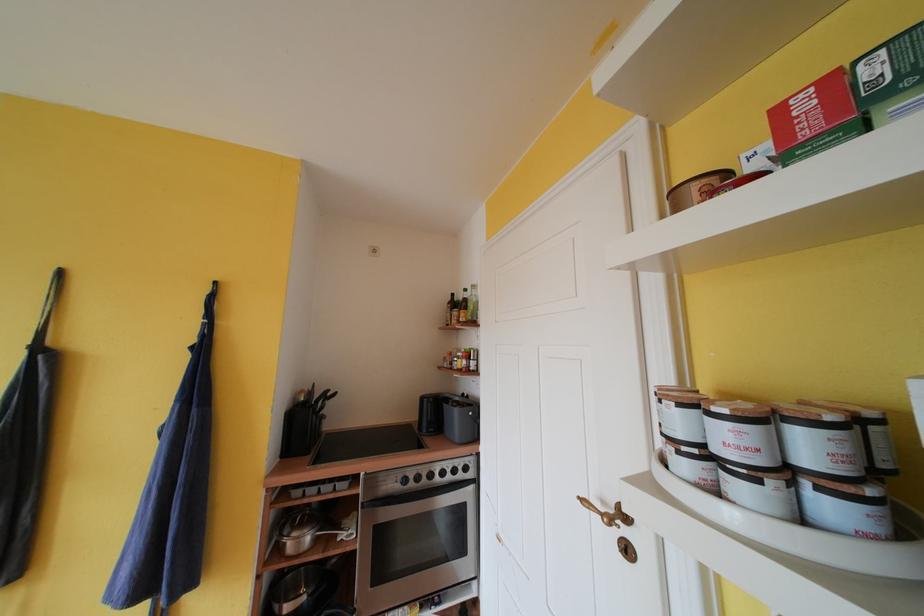
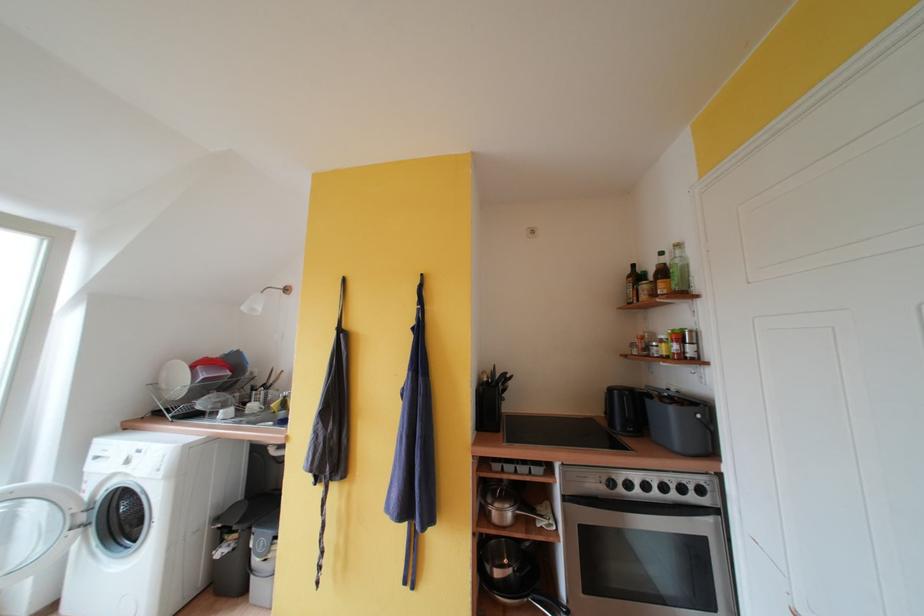
Where in the second image is the point corresponding to point 463,414 from the first image?

(678, 413)